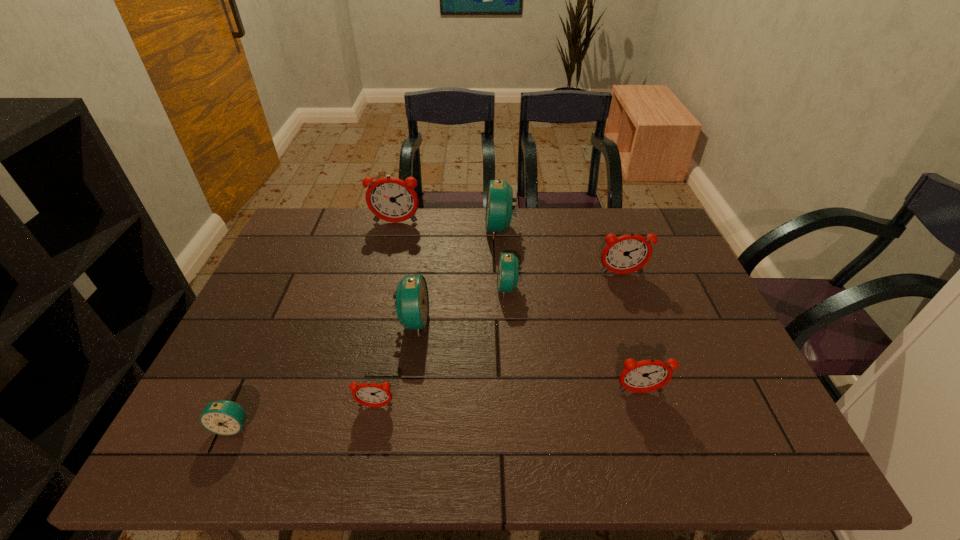
Identify the location of the biggest blue alarm clock. The height and width of the screenshot is (540, 960). (499, 201).

Find the location of `the farthest reddish-pink alarm clock`. the farthest reddish-pink alarm clock is located at coordinates (391, 199).

The image size is (960, 540). What are the coordinates of `the fifth farthest alarm clock` in the screenshot? It's located at (412, 301).

Identify the location of the second blue alarm clock from left to right. Image resolution: width=960 pixels, height=540 pixels. (412, 301).

Find the location of a particular element. the third smallest reddish-pink alarm clock is located at coordinates (628, 253).

At what (x,y) coordinates should I click in order to perform the action: click on the third biggest blue alarm clock. Please return your answer as a coordinate pair (x, y). This screenshot has width=960, height=540. Looking at the image, I should click on (508, 268).

Where is `the sixth farthest object`? the sixth farthest object is located at coordinates (643, 376).

Where is `the third biggest reddish-pink alarm clock`? Image resolution: width=960 pixels, height=540 pixels. the third biggest reddish-pink alarm clock is located at coordinates (643, 376).

Locate an element on the screen. This screenshot has width=960, height=540. the nearest reddish-pink alarm clock is located at coordinates (368, 394).

At what (x,y) coordinates should I click in order to perform the action: click on the smallest reddish-pink alarm clock. Please return your answer as a coordinate pair (x, y). Looking at the image, I should click on (368, 394).